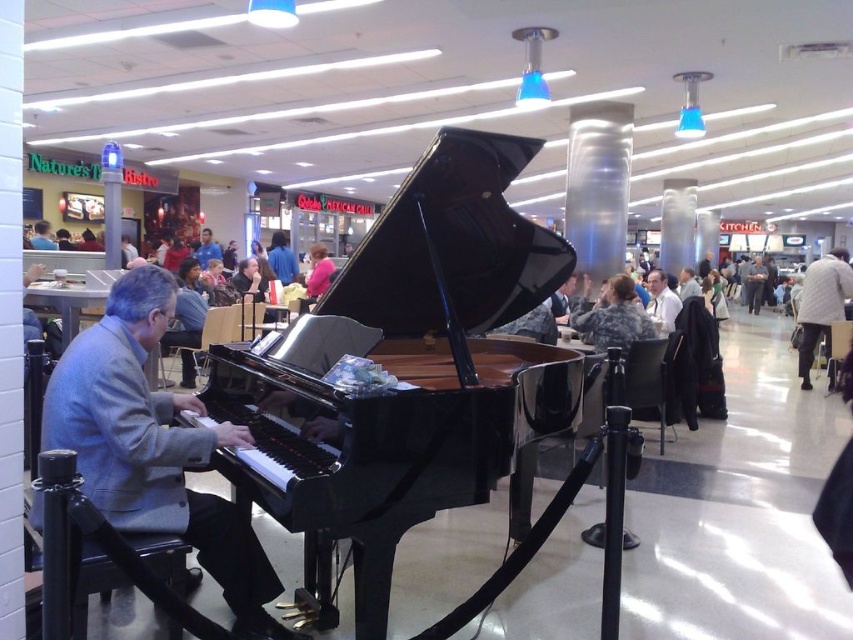
You are standing in the food court and see the grand piano in the center. There is a point marked at coordinates (x=154, y=448). What object is located at that point?

The point at coordinates (x=154, y=448) indicates the gray woolen jacket at left.

You are standing at the entrance of the food court and want to reach the pink fabric jacket at center without crossing the ropes. The black polished piano at center is in your way. Can you walk around it to get closer to the jacket?

The black polished piano at center is 21.28 feet away from the pink fabric jacket at center. Since the piano is in the center and you need to reach the jacket which is also at center, you can walk around the piano to get closer to the pink fabric jacket at center as long as there is a path available outside the ropes.

You are a photographer who wants to take a picture of the black polished piano at center from a distance of 6 feet. Is the camera you are holding at that distance able to capture the entire piano in the frame?

The black polished piano at center and camera are 6.10 feet apart. Since the distance is slightly more than 6 feet, the photographer can adjust their position slightly closer or use a wider lens to ensure the entire piano fits in the frame.